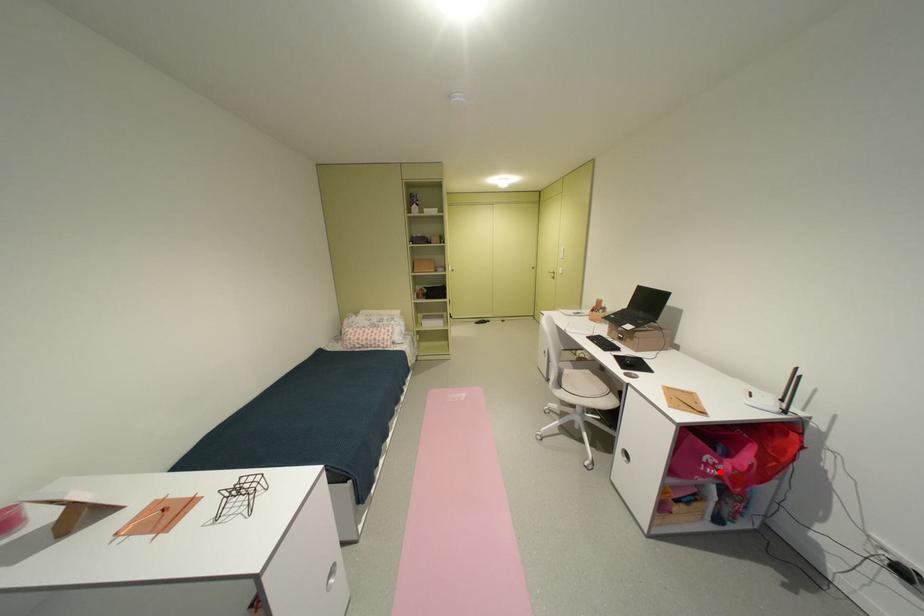
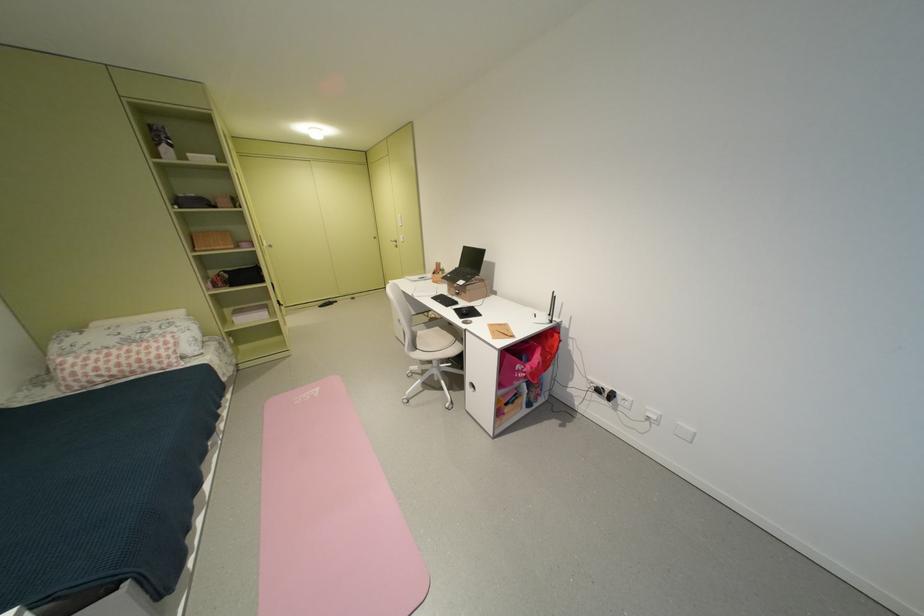
Question: I am providing you with two images of the same scene from different viewpoints. Given a red point in image1, look at the same physical point in image2. Is it:

Choices:
 (A) Closer to the viewpoint
 (B) Farther from the viewpoint

Answer: (B)